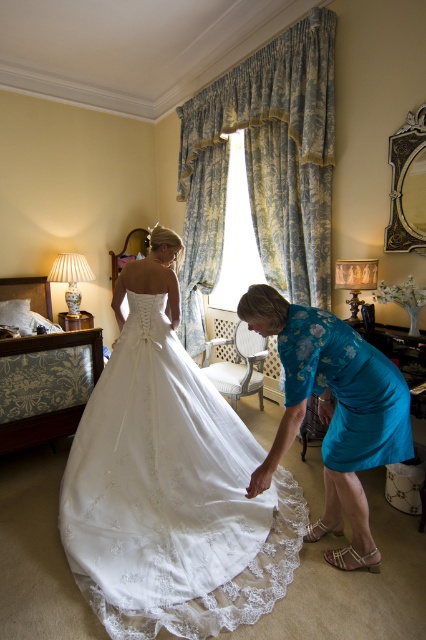
Question: Which object is the farthest from the blue satin dress at lower center?

Choices:
 (A) white lace dress at center
 (B) matte blue dress at lower right

Answer: (A)

Question: Which object is farther from the camera taking this photo?

Choices:
 (A) matte blue dress at lower right
 (B) blue satin dress at lower center

Answer: (B)

Question: Considering the real-world distances, which object is farthest from the blue satin dress at lower center?

Choices:
 (A) white lace dress at center
 (B) matte blue dress at lower right

Answer: (A)

Question: Can you confirm if white lace dress at center is thinner than blue satin dress at lower center?

Choices:
 (A) no
 (B) yes

Answer: (A)

Question: Can you confirm if blue satin dress at lower center is positioned to the right of matte blue dress at lower right?

Choices:
 (A) yes
 (B) no

Answer: (B)

Question: Can you confirm if white lace dress at center is positioned to the left of blue satin dress at lower center?

Choices:
 (A) no
 (B) yes

Answer: (B)